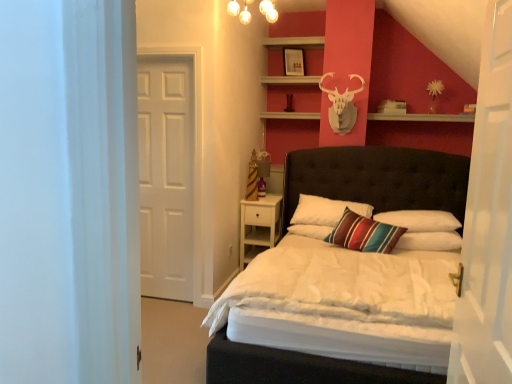
Question: Is matte glass chandelier at upper center not inside tufted leather bed at center?

Choices:
 (A) no
 (B) yes

Answer: (B)

Question: From the image's perspective, would you say matte glass chandelier at upper center is shown under tufted leather bed at center?

Choices:
 (A) no
 (B) yes

Answer: (A)

Question: Considering the relative sizes of matte glass chandelier at upper center and tufted leather bed at center in the image provided, is matte glass chandelier at upper center taller than tufted leather bed at center?

Choices:
 (A) no
 (B) yes

Answer: (A)

Question: Does matte glass chandelier at upper center have a larger size compared to tufted leather bed at center?

Choices:
 (A) no
 (B) yes

Answer: (A)

Question: Is matte glass chandelier at upper center facing towards tufted leather bed at center?

Choices:
 (A) yes
 (B) no

Answer: (B)

Question: In terms of width, does matte white picture frame at upper center look wider or thinner when compared to white soft pillow at center, the 1th pillow positioned from the right?

Choices:
 (A) thin
 (B) wide

Answer: (A)

Question: Is point (301, 54) positioned closer to the camera than point (421, 231)?

Choices:
 (A) closer
 (B) farther

Answer: (B)

Question: From the image's perspective, is matte white picture frame at upper center located above or below white soft pillow at center, the 1th pillow positioned from the right?

Choices:
 (A) above
 (B) below

Answer: (A)

Question: From a real-world perspective, relative to white soft pillow at center, marked as the third pillow in a left-to-right arrangement, is matte white picture frame at upper center vertically above or below?

Choices:
 (A) below
 (B) above

Answer: (B)

Question: Visually, is white wooden door at right, which appears as the first door when viewed from the front, positioned to the left or to the right of matte white picture frame at upper center?

Choices:
 (A) left
 (B) right

Answer: (B)

Question: From the image's perspective, is white wooden door at right, which appears as the first door when viewed from the front, above or below matte white picture frame at upper center?

Choices:
 (A) above
 (B) below

Answer: (B)

Question: Considering the positions of point (481, 332) and point (296, 72), is point (481, 332) closer or farther from the camera than point (296, 72)?

Choices:
 (A) closer
 (B) farther

Answer: (A)

Question: From a real-world perspective, is white wooden door at right, the second door when ordered from left to right, positioned above or below matte white picture frame at upper center?

Choices:
 (A) below
 (B) above

Answer: (A)

Question: From the image's perspective, is tufted leather bed at center located above or below white matte door at left, which is counted as the second door, starting from the right?

Choices:
 (A) below
 (B) above

Answer: (A)

Question: Considering the positions of tufted leather bed at center and white matte door at left, which ranks as the first door in back-to-front order, in the image, is tufted leather bed at center taller or shorter than white matte door at left, which ranks as the first door in back-to-front order,?

Choices:
 (A) short
 (B) tall

Answer: (A)